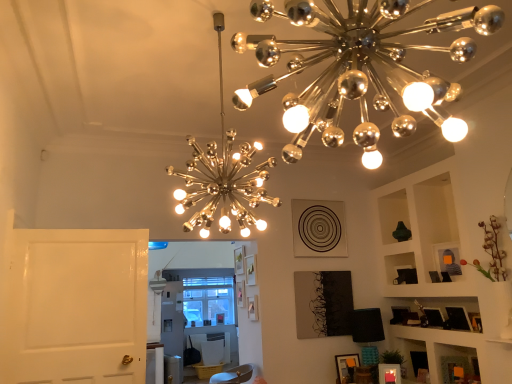
Question: Should I look upward or downward to see wooden picture frame at lower right, acting as the first picture frame starting from the front?

Choices:
 (A) up
 (B) down

Answer: (B)

Question: Which direction should I rotate to face metallic chandelier at upper center, the first lamp when ordered from top to bottom, — up or down?

Choices:
 (A) up
 (B) down

Answer: (A)

Question: Is white glossy door at left not near metallic chandelier at upper center, which ranks as the 3th lamp in bottom-to-top order?

Choices:
 (A) no
 (B) yes

Answer: (B)

Question: From the image's perspective, is white glossy door at left above metallic chandelier at upper center, the first lamp when ordered from top to bottom?

Choices:
 (A) no
 (B) yes

Answer: (A)

Question: Considering the relative sizes of white glossy door at left and metallic chandelier at upper center, which appears as the first lamp when viewed from the front, in the image provided, is white glossy door at left taller than metallic chandelier at upper center, which appears as the first lamp when viewed from the front,?

Choices:
 (A) no
 (B) yes

Answer: (B)

Question: Can you confirm if white glossy door at left is thinner than metallic chandelier at upper center, which appears as the first lamp when viewed from the front?

Choices:
 (A) no
 (B) yes

Answer: (B)

Question: From a real-world perspective, is white glossy door at left under metallic chandelier at upper center, which appears as the first lamp when viewed from the front?

Choices:
 (A) no
 (B) yes

Answer: (B)

Question: Does white glossy door at left appear on the left side of metallic chandelier at upper center, the first lamp when ordered from top to bottom?

Choices:
 (A) no
 (B) yes

Answer: (B)

Question: Is metallic silver chandelier at upper center, which is the first lamp in left-to-right order, located outside metallic chandelier at upper center, the first lamp when ordered from top to bottom?

Choices:
 (A) no
 (B) yes

Answer: (B)

Question: Is metallic silver chandelier at upper center, positioned as the 2th lamp in front-to-back order, positioned before metallic chandelier at upper center, which appears as the first lamp when viewed from the front?

Choices:
 (A) no
 (B) yes

Answer: (A)

Question: From the image's perspective, is metallic silver chandelier at upper center, which appears as the second lamp when ordered from the bottom, located beneath metallic chandelier at upper center, which ranks as the 2th lamp in right-to-left order?

Choices:
 (A) no
 (B) yes

Answer: (B)

Question: From the image's perspective, would you say metallic silver chandelier at upper center, positioned as the 3th lamp in right-to-left order, is positioned over metallic chandelier at upper center, which appears as the first lamp when viewed from the front?

Choices:
 (A) no
 (B) yes

Answer: (A)

Question: Is metallic silver chandelier at upper center, positioned as the 3th lamp in right-to-left order, thinner than metallic chandelier at upper center, which appears as the first lamp when viewed from the front?

Choices:
 (A) no
 (B) yes

Answer: (A)

Question: Can you confirm if metallic silver chandelier at upper center, which is the first lamp in left-to-right order, is shorter than metallic chandelier at upper center, which ranks as the 2th lamp in right-to-left order?

Choices:
 (A) no
 (B) yes

Answer: (A)

Question: From a real-world perspective, is metallic silver chandelier at upper center, positioned as the 3th lamp in right-to-left order, on top of wooden picture frame at lower right, marked as the first picture frame in a bottom-to-top arrangement?

Choices:
 (A) no
 (B) yes

Answer: (B)